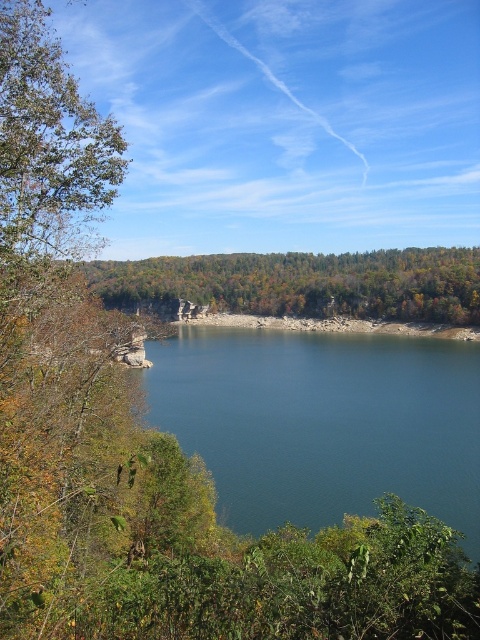
In the scene shown: You are standing at the edge of the lake and want to determine which of the two points, point (360, 387) or point (325, 282), is closer to you. Based on the scene description, which point is nearer?

Point (360, 387) is closer to the viewer than point (325, 282).

Based on the scene description, what is located at the coordinates point (323, 422)?

The coordinates point (323, 422) corresponds to the deep blue water at center.

You are a photographer planning to take a photo of the deep blue water at center and the green leafy trees at center. If your camera has a maximum focus range of 150 meters, will you be able to capture both subjects clearly in the same shot?

The deep blue water at center is 170.69 meters away from the green leafy trees at center. Since the camera can only focus up to 150 meters, the distance between them exceeds the maximum focus range. Therefore, you cannot capture both subjects clearly in the same shot.